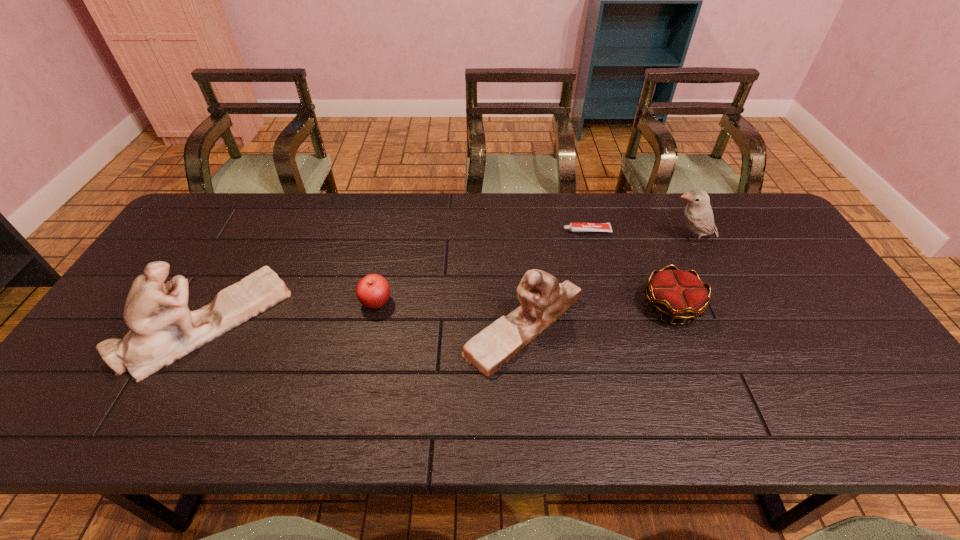
With all figurines evenly spaced, where should an extra figurine be placed on the right to continue the pattern? Please point out a vacant space. Please provide its 2D coordinates. Your answer should be formatted as a tuple, i.e. [(x, y)], where the tuple contains the x and y coordinates of a point satisfying the conditions above.

[(845, 332)]